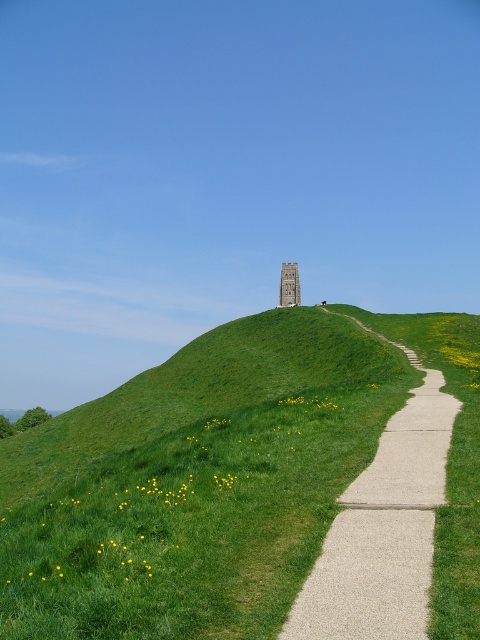
Is point (361, 378) behind point (425, 452)?

That is True.

Find the location of a particular element. green grassy hill at center is located at coordinates (193, 483).

Does green grassy hill at center come in front of stone tower at center?

Yes, it is in front of stone tower at center.

Between green grassy hill at center and stone tower at center, which one is positioned higher?

stone tower at center is higher up.

Where is `green grassy hill at center`? This screenshot has height=640, width=480. green grassy hill at center is located at coordinates (193, 483).

Locate an element on the screen. Image resolution: width=480 pixels, height=640 pixels. green grassy hill at center is located at coordinates (193, 483).

Does point (308, 605) come closer to viewer compared to point (296, 292)?

That is True.

Does light gray gravel path at center have a lesser width compared to stone tower at center?

Incorrect, light gray gravel path at center's width is not less than stone tower at center's.

Between point (379, 541) and point (292, 262), which one is positioned in front?

Point (379, 541) is more forward.

This screenshot has width=480, height=640. I want to click on light gray gravel path at center, so click(384, 528).